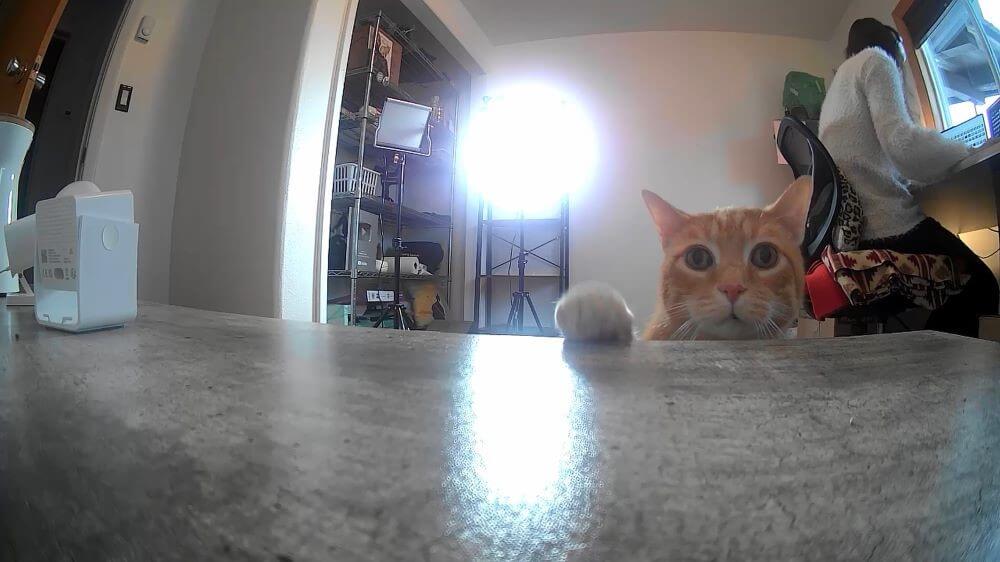
Locate an element on the screen. music stand is located at coordinates (400, 131).